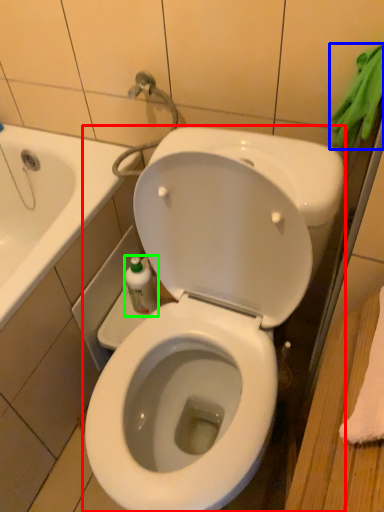
Question: Which is nearer to the toilet (highlighted by a red box)? bath towel (highlighted by a blue box) or bottle (highlighted by a green box).

Choices:
 (A) bath towel
 (B) bottle

Answer: (B)